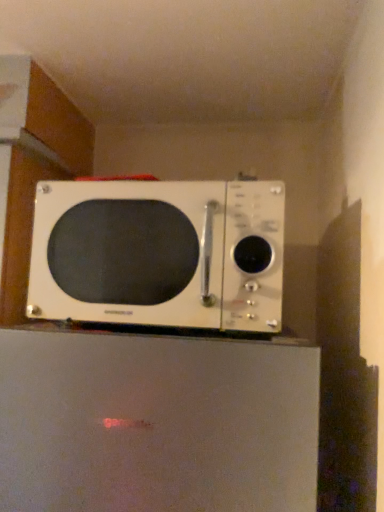
Identify the location of white glossy microwave at center. (159, 253).

This screenshot has height=512, width=384. What do you see at coordinates (159, 253) in the screenshot?
I see `white glossy microwave at center` at bounding box center [159, 253].

Identify the location of white glossy microwave at center. The width and height of the screenshot is (384, 512). (159, 253).